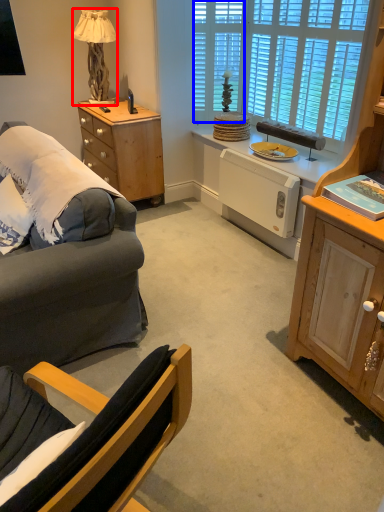
Question: Which of the following is the farthest to the observer, lamp (highlighted by a red box) or glass door (highlighted by a blue box)?

Choices:
 (A) lamp
 (B) glass door

Answer: (B)